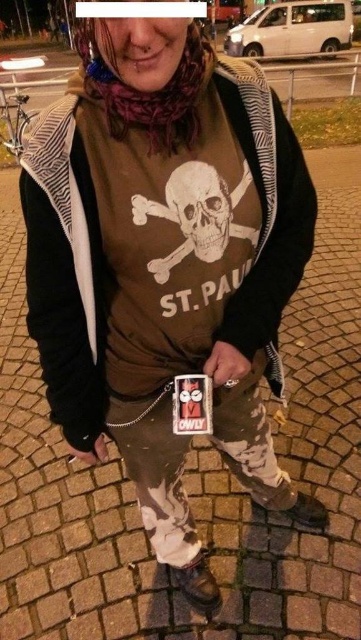
You are standing 10 feet away from the point at coordinates point (199, 202). If you take a step forward of 2 feet, will you be closer than 20 inches to the point?

The distance of point (199, 202) from viewer is 36.29 inches. After stepping forward 2 feet, you will be 36.29 inches minus 24 inches equals 12.29 inches away. Since 12.29 inches is less than 20 inches, yes, you will be closer than 20 inches to the point.